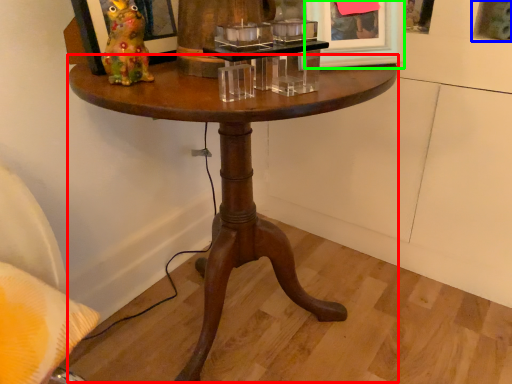
Question: Which object is the closest to the coffee table (highlighted by a red box)? Choose among these: picture frame (highlighted by a blue box) or picture frame (highlighted by a green box).

Choices:
 (A) picture frame
 (B) picture frame

Answer: (B)